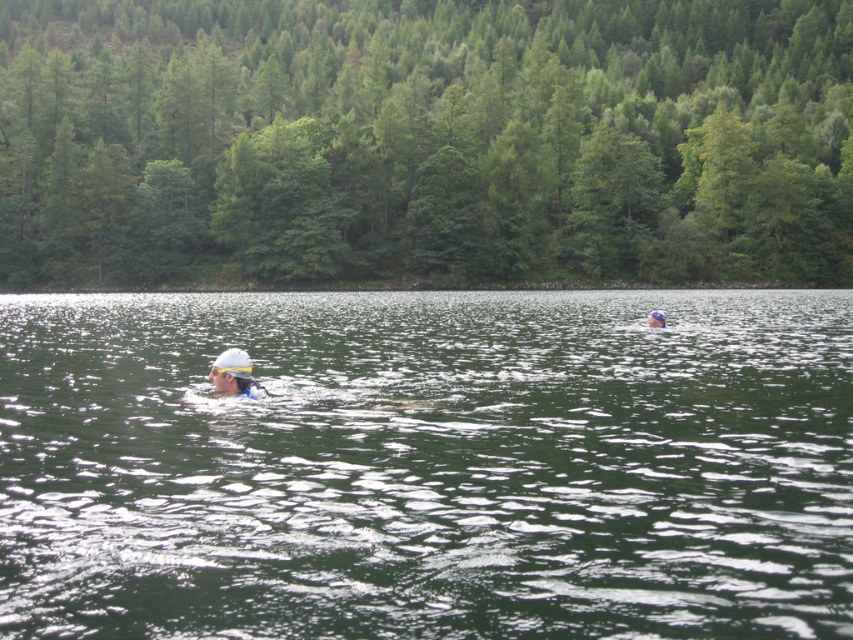
Between white matte swim cap at center and white matte swim cap at upper center, which one is positioned lower?

white matte swim cap at center

Who is positioned more to the left, white matte swim cap at center or white matte swim cap at upper center?

Positioned to the left is white matte swim cap at center.

Locate an element on the screen. Image resolution: width=853 pixels, height=640 pixels. white matte swim cap at center is located at coordinates (234, 374).

The height and width of the screenshot is (640, 853). In order to click on green liquid water at center in this screenshot , I will do `click(427, 465)`.

Who is higher up, green liquid water at center or white matte swim cap at center?

green liquid water at center is above.

What do you see at coordinates (427, 465) in the screenshot? I see `green liquid water at center` at bounding box center [427, 465].

Find the location of a particular element. The width and height of the screenshot is (853, 640). green liquid water at center is located at coordinates (427, 465).